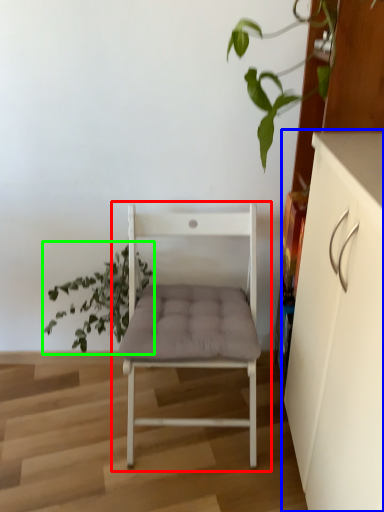
Question: Estimate the real-world distances between objects in this image. Which object is closer to chair (highlighted by a red box), cabinetry (highlighted by a blue box) or houseplant (highlighted by a green box)?

Choices:
 (A) cabinetry
 (B) houseplant

Answer: (B)